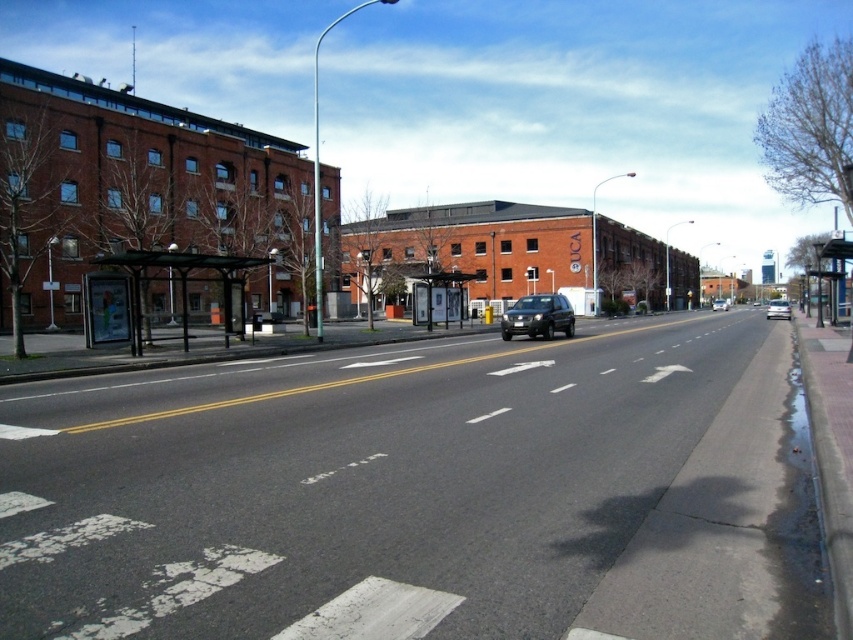
You are a pedestrian trying to cross the street from the left side where the bus stop is located. You see a white glossy sedan at right and a matte black suv at center. Which vehicle is closer to the left side of the street?

The white glossy sedan at right is positioned on the right side of the matte black suv at center, meaning the matte black suv at center is closer to the left side of the street.

You are a delivery person needing to load a tall package into your vehicle. You see both the satin black suv at center and the matte black suv at center. Which one would you choose to load the package into?

You should choose the matte black suv at center because it has a greater height compared to the satin black suv at center, allowing more space for the tall package.